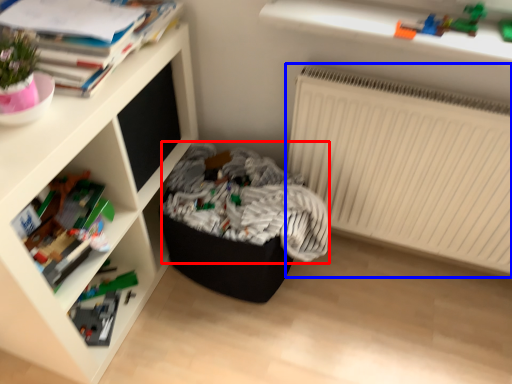
Question: Among these objects, which one is nearest to the camera, laundry (highlighted by a red box) or radiator (highlighted by a blue box)?

Choices:
 (A) laundry
 (B) radiator

Answer: (B)